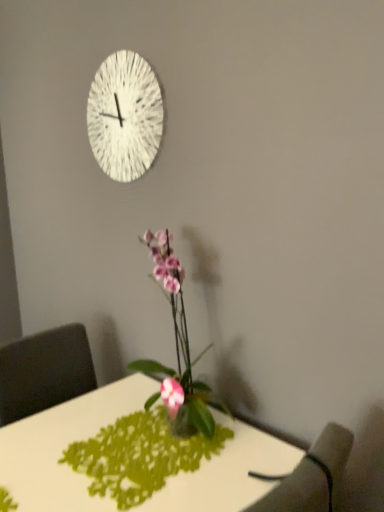
Question: In terms of width, does pink glossy orchid at center look wider or thinner when compared to white glossy desk at center?

Choices:
 (A) wide
 (B) thin

Answer: (B)

Question: In terms of size, does pink glossy orchid at center appear bigger or smaller than white glossy desk at center?

Choices:
 (A) small
 (B) big

Answer: (A)

Question: Which object is the farthest from the dark gray fabric armchair at lower right?

Choices:
 (A) white glossy desk at center
 (B) white textured clock at upper center
 (C) pink glossy orchid at center

Answer: (B)

Question: Estimate the real-world distances between objects in this image. Which object is farther from the white textured clock at upper center?

Choices:
 (A) white glossy desk at center
 (B) dark gray fabric armchair at lower right
 (C) pink glossy orchid at center

Answer: (B)